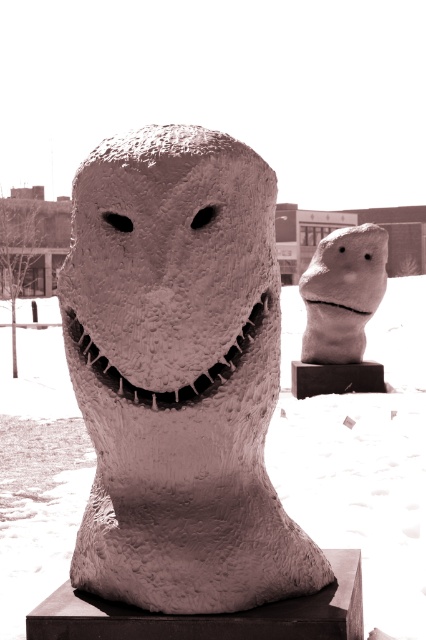
Is point (92, 195) less distant than point (367, 240)?

That is True.

The width and height of the screenshot is (426, 640). Describe the element at coordinates (178, 374) in the screenshot. I see `textured stone head at center` at that location.

Identify the location of textured stone head at center. This screenshot has width=426, height=640. (178, 374).

Does textured stone head at center have a larger size compared to fuzzy textured sculpture at center?

Indeed, textured stone head at center has a larger size compared to fuzzy textured sculpture at center.

Which is in front, point (233, 147) or point (129, 344)?

Point (129, 344) is in front.

You are a GUI agent. You are given a task and a screenshot of the screen. Output one action in this format:
    pyautogui.click(x=<x>, y=<y>)
    Task: Click on the textured stone head at center
    This screenshot has width=426, height=640.
    Given the screenshot: What is the action you would take?
    pyautogui.click(x=178, y=374)

Which of these two, fuzzy textured sculpture at center or white matte stone head at center, stands taller?

With more height is white matte stone head at center.

Can you confirm if fuzzy textured sculpture at center is positioned to the left of white matte stone head at center?

Indeed, fuzzy textured sculpture at center is positioned on the left side of white matte stone head at center.

Which is in front, point (218, 230) or point (342, 292)?

Point (218, 230)

Identify the location of fuzzy textured sculpture at center. (170, 272).